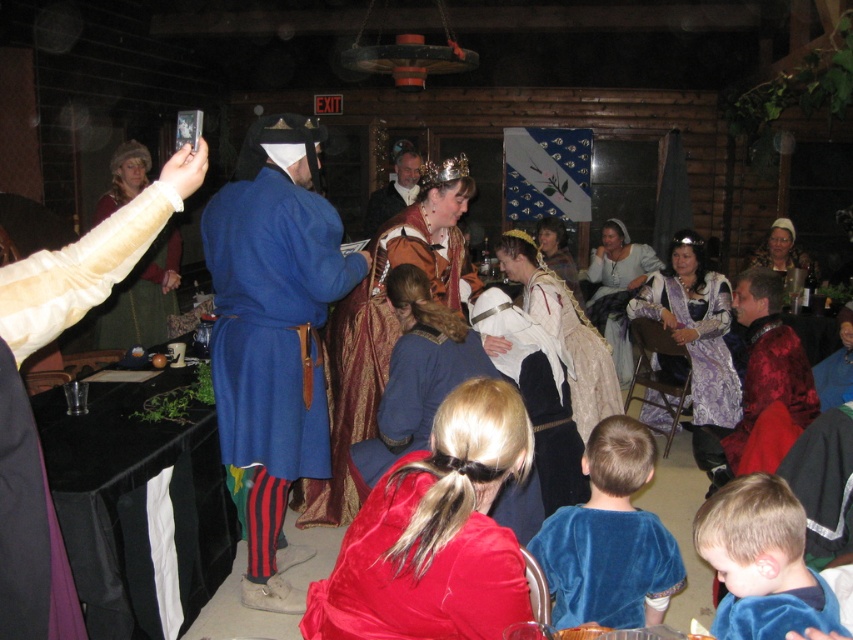
You are a photographer at the medieval event and need to take a photo of the velvet blue tunic at lower right. The camera you have is 6 feet away from the tunic. Can you take the photo without moving closer?

The velvet blue tunic at lower right and camera are 6.87 feet apart from each other. Since the camera is only 6 feet away, you are close enough to take the photo without needing to move closer.

You are a costume designer preparing for a play and need to choose between the velvet blue tunic at lower right and the velvet blue robe at lower right. Based on their sizes, which one would you recommend for a character who needs a more voluminous and dramatic costume?

The velvet blue tunic at lower right is bigger than the velvet blue robe at lower right, so it would be more suitable for a character requiring a voluminous and dramatic costume.

You are an event planner organizing a photo shoot at this medieval event. You need to ensure that the velvet red robe at center and the velvet blue shirt at lower right are both visible in the frame. Based on their positions, which one is closer to the camera?

The velvet red robe at center is positioned over the velvet blue shirt at lower right, meaning it is closer to the camera.